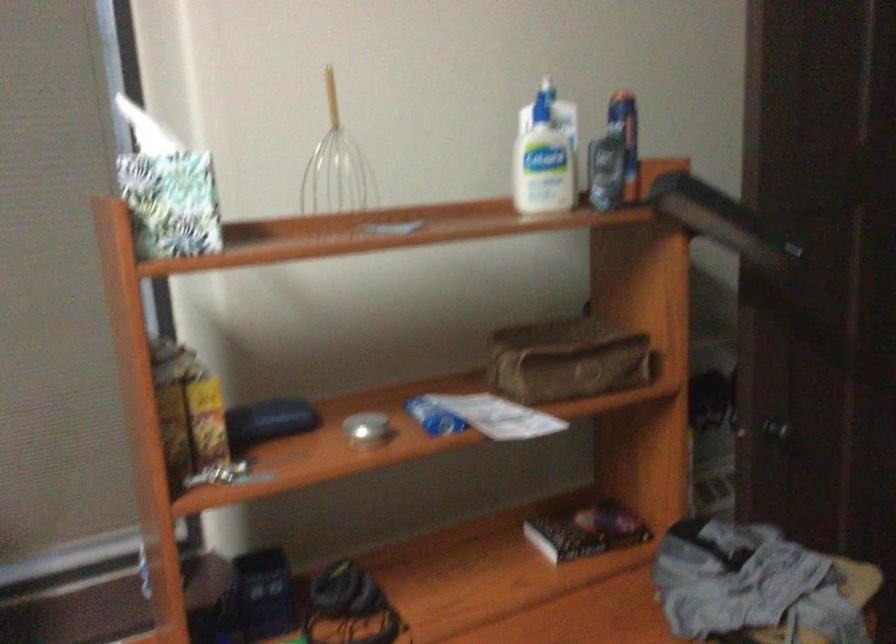
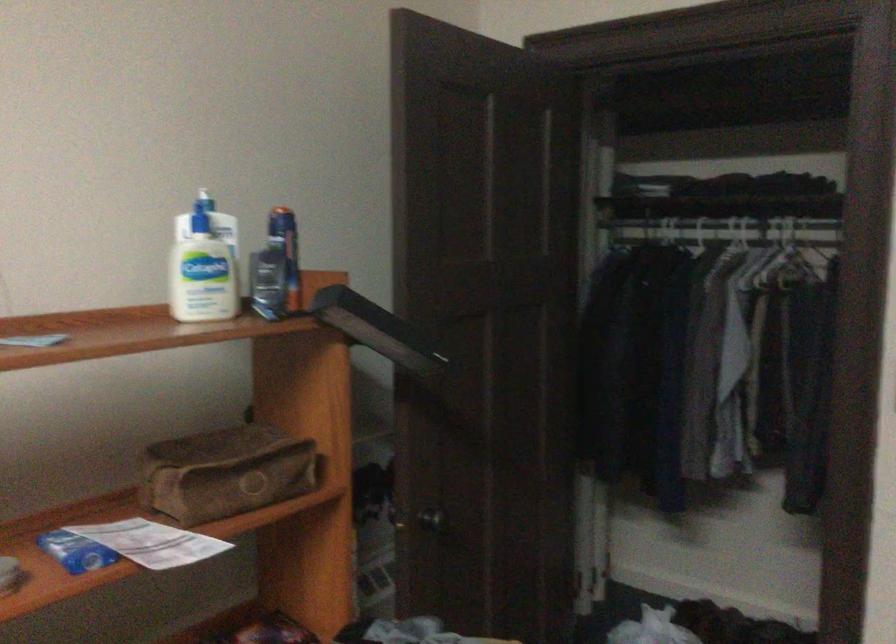
Locate, in the second image, the point that corresponds to (543,156) in the first image.

(203, 265)